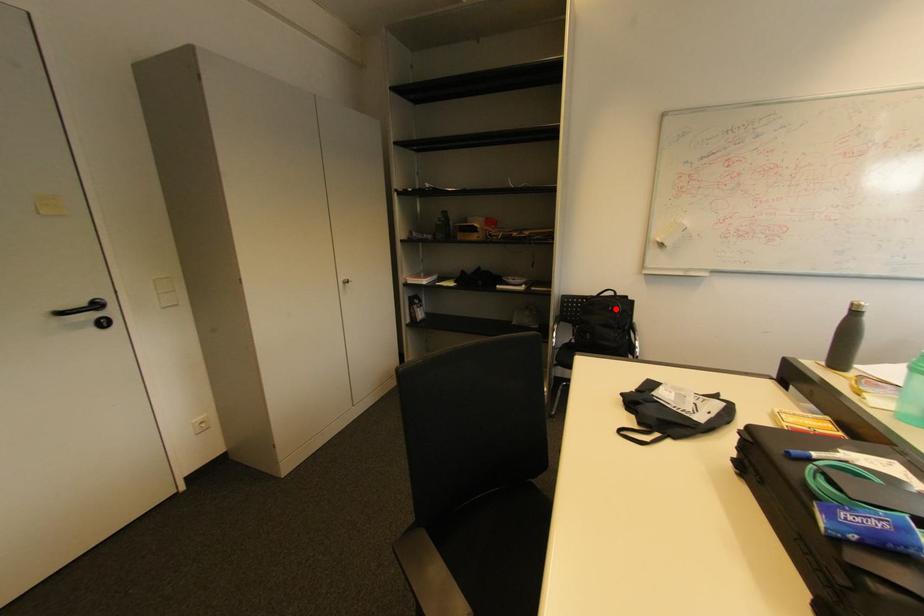
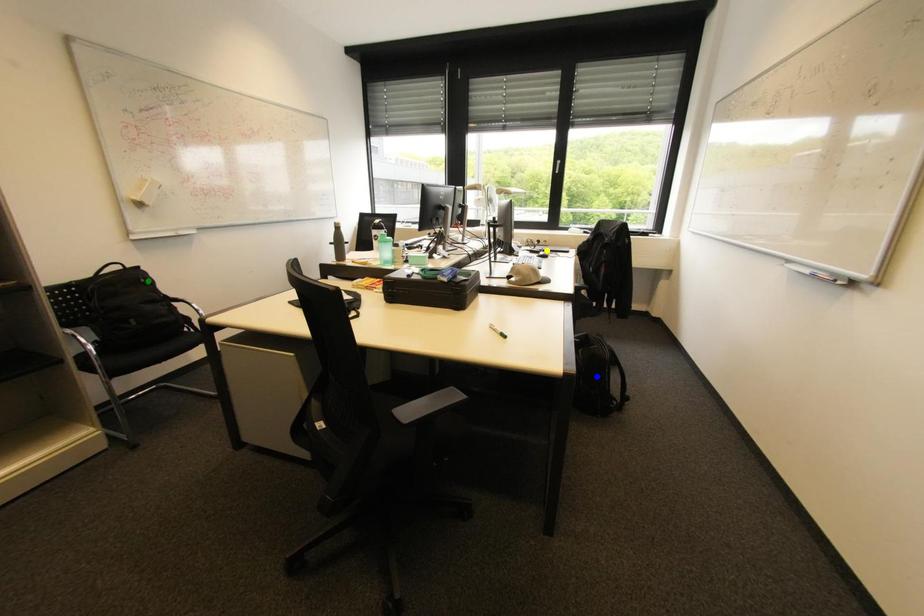
Question: I am providing you with two images of the same scene from different viewpoints. A red point is marked on the first image. You are given multiple points on the second image. Which spot in image 2 lines up with the point in image 1?

Choices:
 (A) yellow point
 (B) blue point
 (C) green point

Answer: (C)